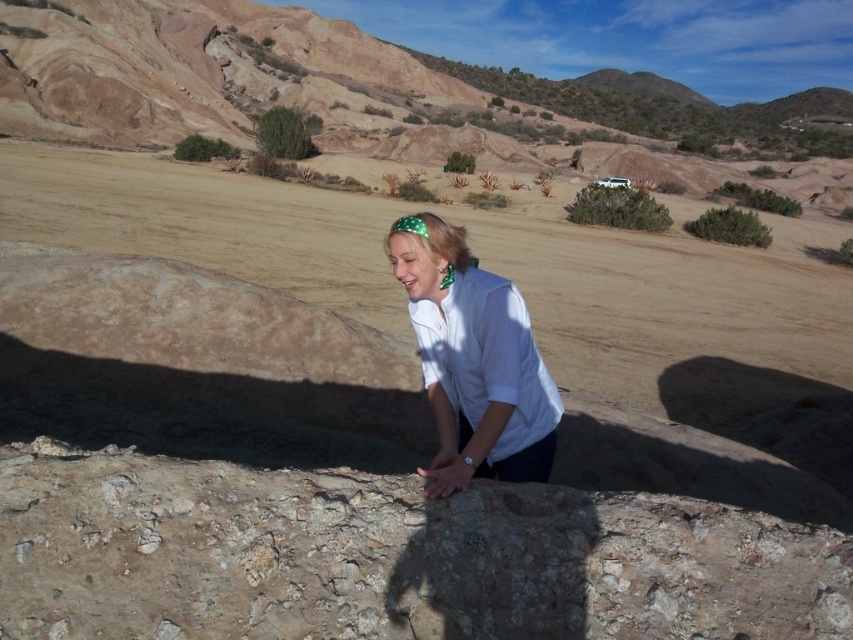
Based on the scene description, where is the brown sandy dirt field at center located in terms of its 2D coordinates?

The brown sandy dirt field at center is located at the 2D coordinates of point (x=485, y=268).